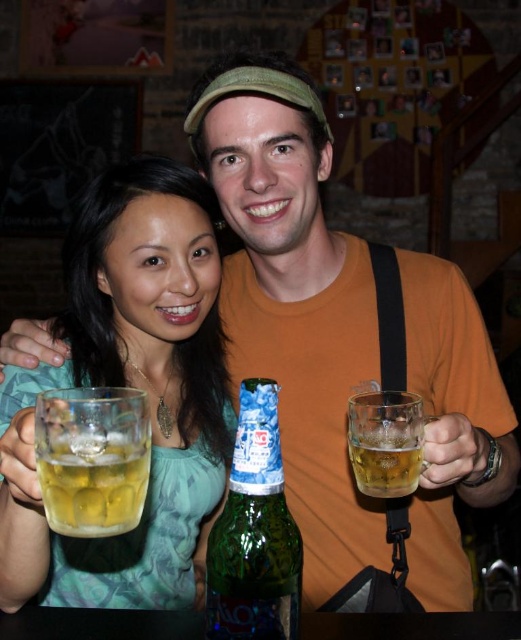
You are at the bar and want to grab the translucent glass mug at upper left. Which direction should you move your hand to reach it?

The translucent glass mug at upper left is located at point 0.605 on the x axis and 0.251 on the y axis. To reach it, move your hand towards the upper left direction from your current position.

You are a bartender who needs to place a new drink order for the translucent glass mug at upper left and the green glass bottle at center. The minimum distance required between drinks to avoid spills is 16 inches. Can the current spacing between them accommodate this requirement?

The distance between the translucent glass mug at upper left and the green glass bottle at center is 16.19 inches, which exceeds the required 16 inches. Therefore, the current spacing can accommodate the requirement.

You are a bartender who needs to pour the contents of the green glass bottle at center into the translucent glass mug at right. Can you do this without spilling?

The green glass bottle at center is positioned under the translucent glass mug at right, so you can pour the contents from the green glass bottle at center into the translucent glass mug at right without spilling.